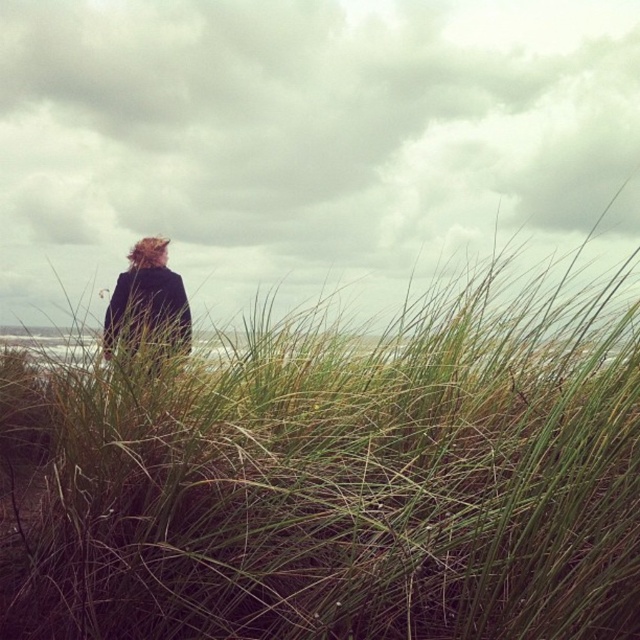
Does green grassy at center have a greater height compared to dark woolen coat at center?

Indeed, green grassy at center has a greater height compared to dark woolen coat at center.

Between green grassy at center and dark woolen coat at center, which one is positioned higher?

dark woolen coat at center is higher up.

Locate an element on the screen. The height and width of the screenshot is (640, 640). green grassy at center is located at coordinates (336, 476).

The height and width of the screenshot is (640, 640). In order to click on green grassy at center in this screenshot , I will do coord(336,476).